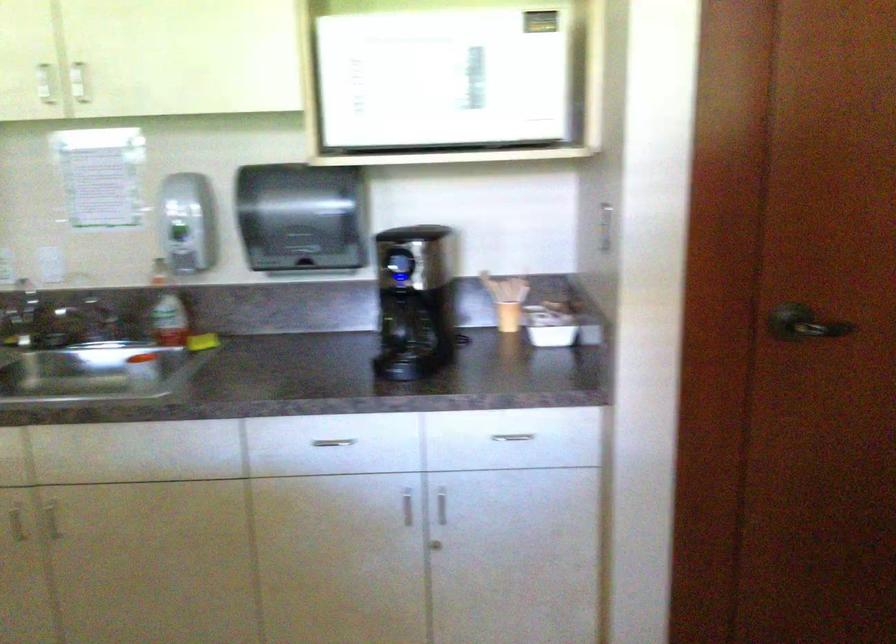
This screenshot has height=644, width=896. I want to click on faucet handle, so click(x=16, y=317).